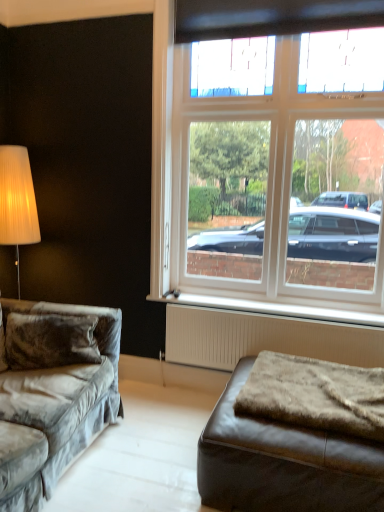
In order to face velvet gray couch at left, should I rotate leftwards or rightwards?

Turn left approximately 24.541 degrees to face it.

This screenshot has height=512, width=384. What do you see at coordinates (52, 395) in the screenshot? I see `velvet gray couch at left` at bounding box center [52, 395].

The image size is (384, 512). What are the coordinates of `white plastic radiator at lower center` in the screenshot? It's located at (272, 308).

What do you see at coordinates (272, 308) in the screenshot? This screenshot has height=512, width=384. I see `white plastic radiator at lower center` at bounding box center [272, 308].

What is the approximate height of brown leather ottoman at lower right?

It is 15.22 inches.

I want to click on white textured radiator at lower center, so click(x=263, y=338).

Can we say brown leather ottoman at lower right lies outside white plastic radiator at lower center?

Absolutely, brown leather ottoman at lower right is external to white plastic radiator at lower center.

From a real-world perspective, which is physically above, brown leather ottoman at lower right or white plastic radiator at lower center?

white plastic radiator at lower center, from a real-world perspective.

Is brown leather ottoman at lower right taller than white plastic radiator at lower center?

Yes, brown leather ottoman at lower right is taller than white plastic radiator at lower center.

Based on the photo, from the image's perspective, which one is positioned higher, white textured radiator at lower center or fuzzy brown blanket at lower right?

From the image's view, white textured radiator at lower center is above.

Between white textured radiator at lower center and fuzzy brown blanket at lower right, which one has smaller width?

Thinner between the two is white textured radiator at lower center.

Considering the relative positions of white textured radiator at lower center and fuzzy brown blanket at lower right in the image provided, is white textured radiator at lower center to the right of fuzzy brown blanket at lower right from the viewer's perspective?

No, white textured radiator at lower center is not to the right of fuzzy brown blanket at lower right.

Considering the relative sizes of brown leather ottoman at lower right and white glass window at center in the image provided, is brown leather ottoman at lower right shorter than white glass window at center?

Indeed, brown leather ottoman at lower right has a lesser height compared to white glass window at center.

From a real-world perspective, between brown leather ottoman at lower right and white glass window at center, who is vertically higher?

white glass window at center is physically above.

Considering the sizes of objects brown leather ottoman at lower right and white glass window at center in the image provided, who is thinner, brown leather ottoman at lower right or white glass window at center?

white glass window at center is thinner.

From the image's perspective, is brown leather ottoman at lower right located beneath white glass window at center?

Yes.

Is fuzzy brown blanket at lower right turned away from white glass window at center?

No, fuzzy brown blanket at lower right is not facing away from white glass window at center.

Between point (349, 429) and point (323, 106), which one is positioned behind?

The point (323, 106) is farther from the camera.

Where is `window located on the left of fuzzy brown blanket at lower right`? The height and width of the screenshot is (512, 384). window located on the left of fuzzy brown blanket at lower right is located at coordinates (273, 175).

Are fuzzy brown blanket at lower right and white glass window at center located far from each other?

Yes, fuzzy brown blanket at lower right is far from white glass window at center.

Is brown leather ottoman at lower right positioned with its back to velvet gray couch at left?

No, brown leather ottoman at lower right is not facing away from velvet gray couch at left.

Based on their sizes in the image, would you say brown leather ottoman at lower right is bigger or smaller than velvet gray couch at left?

Clearly, brown leather ottoman at lower right is smaller in size than velvet gray couch at left.

The height and width of the screenshot is (512, 384). In the image, there is a brown leather ottoman at lower right. In order to click on studio couch above it (from the image's perspective) in this screenshot , I will do `click(52, 395)`.

Is brown leather ottoman at lower right positioned beyond the bounds of velvet gray couch at left?

Yes, brown leather ottoman at lower right is not within velvet gray couch at left.

Considering the positions of point (2, 489) and point (375, 335), is point (2, 489) closer or farther from the camera than point (375, 335)?

Point (2, 489).

Based on the photo, is velvet gray couch at left smaller than white textured radiator at lower center?

Incorrect, velvet gray couch at left is not smaller in size than white textured radiator at lower center.

From the image's perspective, between velvet gray couch at left and white textured radiator at lower center, which one is located above?

From the image's view, white textured radiator at lower center is above.

Is velvet gray couch at left positioned beyond the bounds of fuzzy brown blanket at lower right?

Absolutely, velvet gray couch at left is external to fuzzy brown blanket at lower right.

Looking at the image, does velvet gray couch at left seem bigger or smaller compared to fuzzy brown blanket at lower right?

In the image, velvet gray couch at left appears to be larger than fuzzy brown blanket at lower right.

Is point (1, 350) positioned behind point (339, 391)?

Yes, it is behind point (339, 391).

Would you say velvet gray couch at left is a long distance from fuzzy brown blanket at lower right?

No, there isn't a large distance between velvet gray couch at left and fuzzy brown blanket at lower right.

You are a GUI agent. You are given a task and a screenshot of the screen. Output one action in this format:
    pyautogui.click(x=<x>, y=<y>)
    Task: Click on the window sill lying on the left of brown leather ottoman at lower right
    
    Given the screenshot: What is the action you would take?
    pyautogui.click(x=272, y=308)

What are the coordinates of `blanket that is below the white textured radiator at lower center (from the image's perspective)` in the screenshot? It's located at (315, 395).

Looking at the image, which one is located further to white textured radiator at lower center, velvet gray couch at left or brown leather ottoman at lower right?

Based on the image, velvet gray couch at left appears to be further to white textured radiator at lower center.

Estimate the real-world distances between objects in this image. Which object is closer to velvet gray couch at left, white plastic radiator at lower center or fuzzy brown blanket at lower right?

Based on the image, fuzzy brown blanket at lower right appears to be nearer to velvet gray couch at left.

Looking at the image, which one is located closer to velvet gray couch at left, white textured radiator at lower center or white glass window at center?

white textured radiator at lower center.

From the image, which object appears to be farther from fuzzy brown blanket at lower right, white textured radiator at lower center or white plastic radiator at lower center?

white plastic radiator at lower center.

When comparing their distances from white textured radiator at lower center, does brown leather ottoman at lower right or fuzzy brown blanket at lower right seem further?

Among the two, brown leather ottoman at lower right is located further to white textured radiator at lower center.

In the scene shown: Based on their spatial positions, is fuzzy brown blanket at lower right or velvet gray couch at left closer to brown leather ottoman at lower right?

fuzzy brown blanket at lower right is positioned closer to the anchor brown leather ottoman at lower right.

From the image, which object appears to be farther from fuzzy brown blanket at lower right, velvet gray couch at left or brown leather ottoman at lower right?

Among the two, velvet gray couch at left is located further to fuzzy brown blanket at lower right.

Looking at the image, which one is located closer to white textured radiator at lower center, velvet gray couch at left or white glass window at center?

white glass window at center is positioned closer to the anchor white textured radiator at lower center.

Where is `studio sofa between velvet gray couch at left and fuzzy brown blanket at lower right from left to right`? studio sofa between velvet gray couch at left and fuzzy brown blanket at lower right from left to right is located at coordinates (283, 463).

Where is `window sill between white glass window at center and white textured radiator at lower center in the up-down direction`? window sill between white glass window at center and white textured radiator at lower center in the up-down direction is located at coordinates (272, 308).

Image resolution: width=384 pixels, height=512 pixels. In order to click on radiator located between fuzzy brown blanket at lower right and white plastic radiator at lower center in the depth direction in this screenshot , I will do `click(263, 338)`.

At what (x,y) coordinates should I click in order to perform the action: click on window sill that lies between white glass window at center and fuzzy brown blanket at lower right from top to bottom. Please return your answer as a coordinate pair (x, y). The width and height of the screenshot is (384, 512). Looking at the image, I should click on (272, 308).